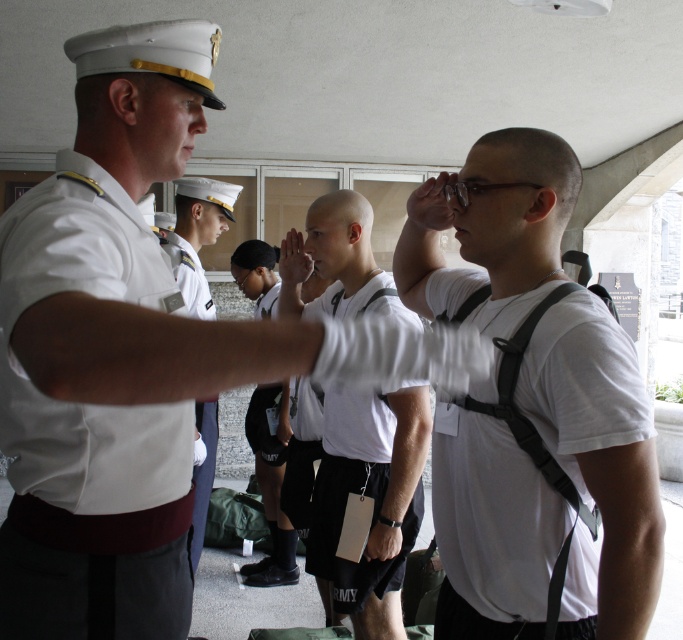
Which is in front, point (36, 580) or point (393, 304)?

Point (36, 580)

Locate an element on the screen. Image resolution: width=683 pixels, height=640 pixels. white smooth shirt at center is located at coordinates (87, 432).

At what (x,y) coordinates should I click in order to perform the action: click on white smooth shirt at center. Please return your answer as a coordinate pair (x, y). This screenshot has height=640, width=683. Looking at the image, I should click on (x=87, y=432).

Is white matte uniform at center below white matte shirt at center?

No, white matte uniform at center is not below white matte shirt at center.

Can you confirm if white matte uniform at center is positioned above white matte shirt at center?

Yes, white matte uniform at center is above white matte shirt at center.

Between point (92, 595) and point (342, 577), which one is positioned in front?

Positioned in front is point (92, 595).

Locate an element on the screen. The width and height of the screenshot is (683, 640). white matte uniform at center is located at coordinates click(111, 353).

Which is more to the right, white matte t-shirt at right or white uniform at center?

white matte t-shirt at right

Can you confirm if white matte t-shirt at right is bigger than white uniform at center?

Incorrect, white matte t-shirt at right is not larger than white uniform at center.

This screenshot has height=640, width=683. What do you see at coordinates (492, 516) in the screenshot?
I see `white matte t-shirt at right` at bounding box center [492, 516].

The height and width of the screenshot is (640, 683). Find the location of `white matte t-shirt at right`. white matte t-shirt at right is located at coordinates (492, 516).